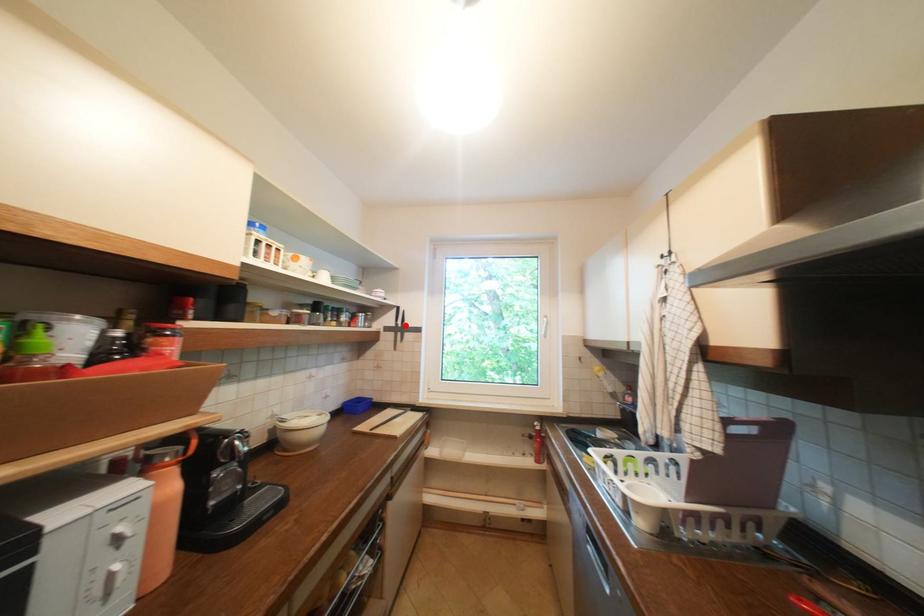
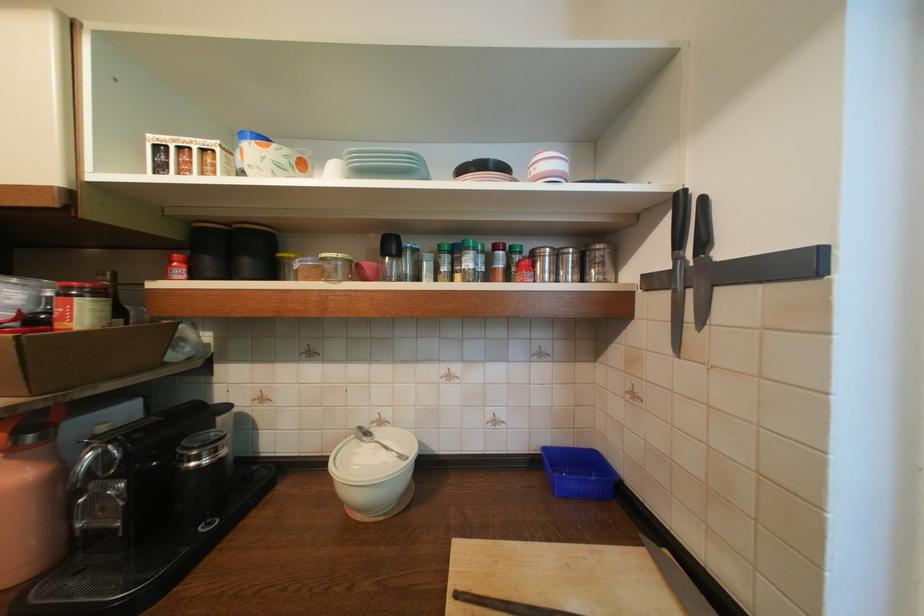
In the second image, find the point that corresponds to the highlighted location in the first image.

(686, 261)